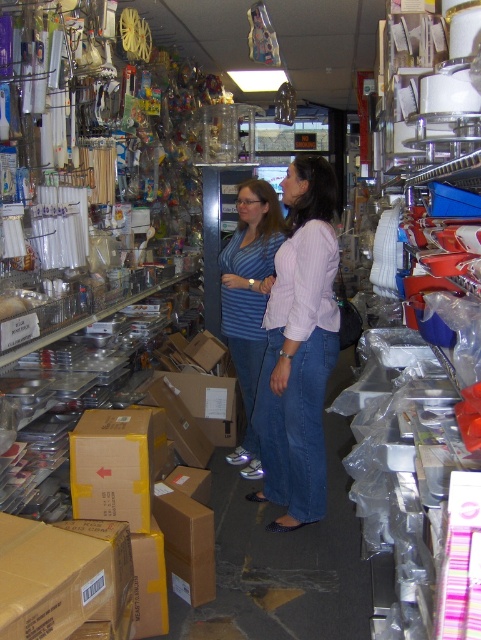
Question: Which object appears closest to the camera in this image?

Choices:
 (A) blue striped shirt at center
 (B) light purple shirt at center
 (C) yellow cardboard box at center

Answer: (C)

Question: Observing the image, what is the correct spatial positioning of light purple shirt at center in reference to yellow cardboard box at center?

Choices:
 (A) above
 (B) below

Answer: (A)

Question: Which object is closer to the camera taking this photo?

Choices:
 (A) light purple shirt at center
 (B) yellow cardboard box at center

Answer: (B)

Question: Is light purple shirt at center further to the viewer compared to yellow cardboard box at center?

Choices:
 (A) yes
 (B) no

Answer: (A)

Question: Can you confirm if light purple shirt at center is smaller than yellow cardboard box at center?

Choices:
 (A) no
 (B) yes

Answer: (A)

Question: Which is farther from the blue striped shirt at center?

Choices:
 (A) light purple shirt at center
 (B) yellow cardboard box at center

Answer: (B)